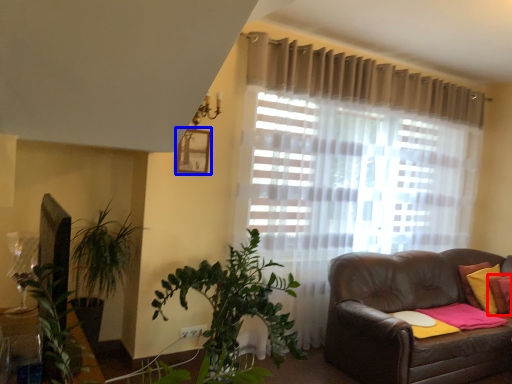
Question: Which point is further to the camera, pillow (highlighted by a red box) or picture frame (highlighted by a blue box)?

Choices:
 (A) pillow
 (B) picture frame

Answer: (A)